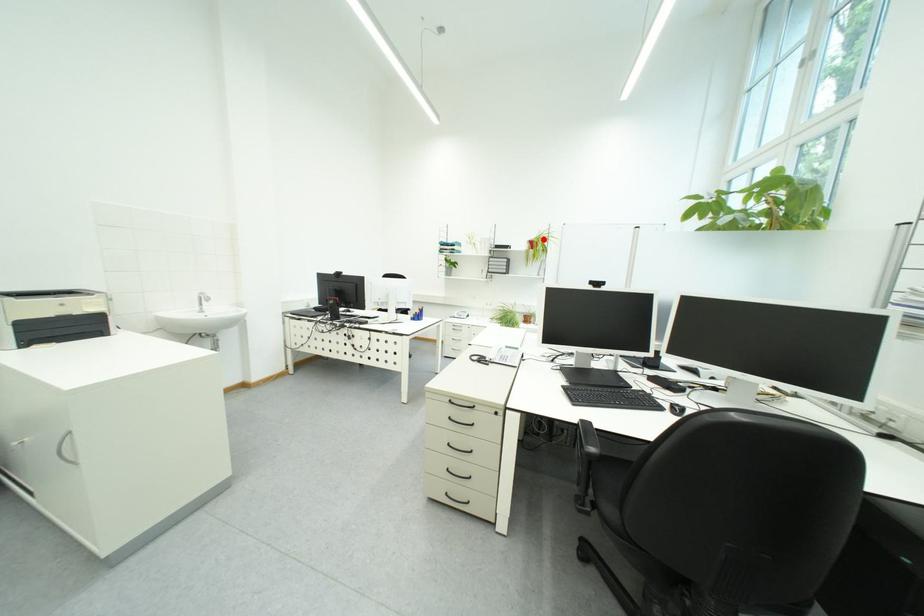
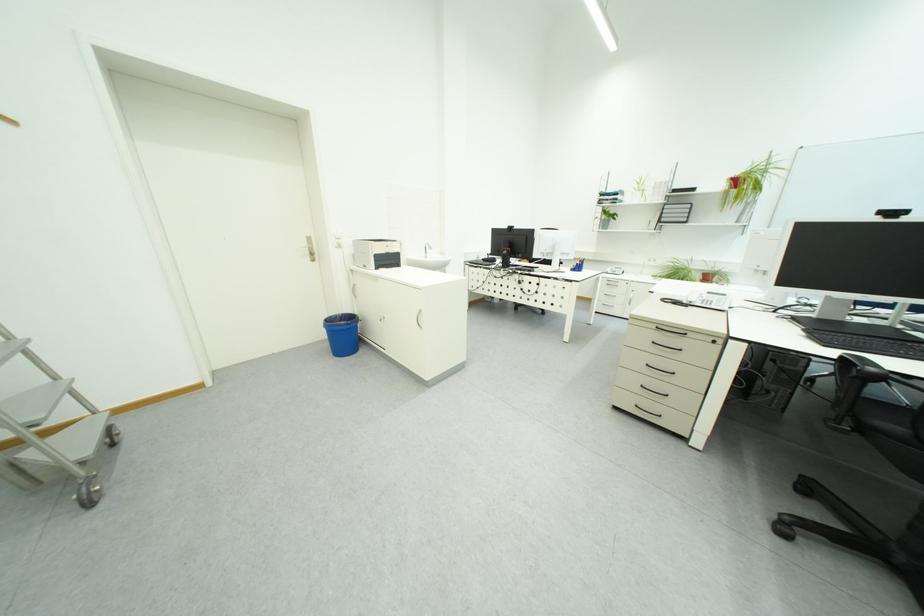
The point at the highlighted location is marked in the first image. Where is the corresponding point in the second image?

(748, 175)